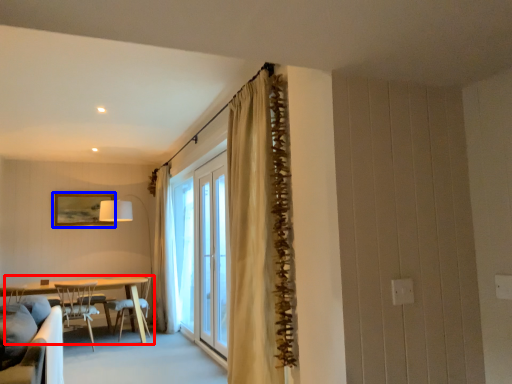
Question: Which object is further to the camera taking this photo, kitchen & dining room table (highlighted by a red box) or picture frame (highlighted by a blue box)?

Choices:
 (A) kitchen & dining room table
 (B) picture frame

Answer: (B)